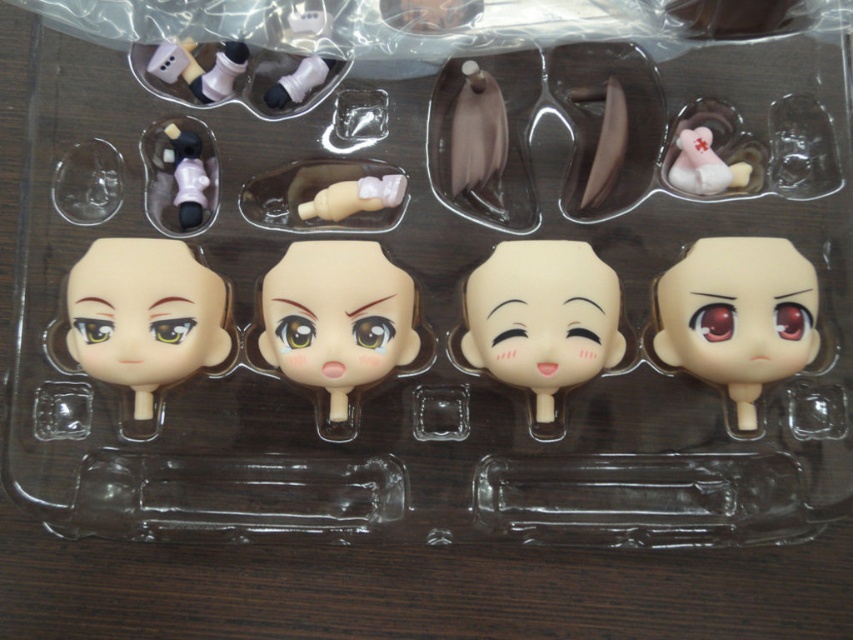
Question: Is smooth beige doll head at center wider than matte black arm at upper center?

Choices:
 (A) no
 (B) yes

Answer: (B)

Question: Which of the following is the closest to the observer?

Choices:
 (A) (744, 333)
 (B) (276, 93)
 (C) (604, 346)
 (D) (306, 211)

Answer: (A)

Question: Is smooth beige doll head at center closer to the viewer compared to smooth beige face at center?

Choices:
 (A) yes
 (B) no

Answer: (B)

Question: Which point is closer to the camera?

Choices:
 (A) white matte plush toy at upper right
 (B) smooth beige doll head at center
 (C) satin white doll head at right

Answer: (C)

Question: Can you confirm if smooth beige doll head at center is thinner than white matte plush toy at upper right?

Choices:
 (A) yes
 (B) no

Answer: (B)

Question: Which of the following is the closest to the observer?

Choices:
 (A) smooth beige face at center
 (B) matte pink plastic doll at upper left
 (C) matte pink plastic hand at center

Answer: (A)